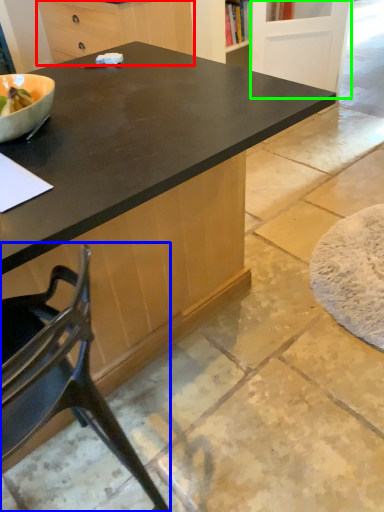
Question: Estimate the real-world distances between objects in this image. Which object is closer to cabinetry (highlighted by a red box), chair (highlighted by a blue box) or screen door (highlighted by a green box)?

Choices:
 (A) chair
 (B) screen door

Answer: (B)